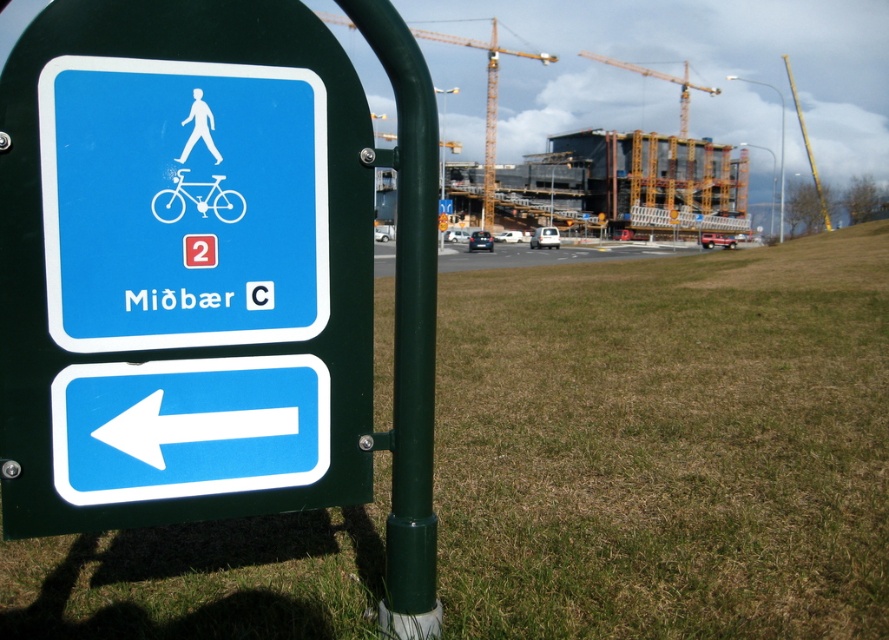
Is green grass at lower center shorter than blue plastic arrow at lower left?

No, green grass at lower center is not shorter than blue plastic arrow at lower left.

Is green grass at lower center above blue plastic arrow at lower left?

Indeed, green grass at lower center is positioned over blue plastic arrow at lower left.

From the picture: Who is more distant from viewer, (770, 416) or (154, 380)?

Positioned behind is point (770, 416).

What are the coordinates of `green grass at lower center` in the screenshot? It's located at (667, 444).

Can you confirm if green grass at lower center is taller than matte plastic sign at left?

Indeed, green grass at lower center has a greater height compared to matte plastic sign at left.

Where is `green grass at lower center`? green grass at lower center is located at coordinates (667, 444).

Identify the location of green grass at lower center. (667, 444).

Is yellow metallic crane at upper center wider than white glossy bicycle at center?

Yes.

Is yellow metallic crane at upper center smaller than white glossy bicycle at center?

No, yellow metallic crane at upper center is not smaller than white glossy bicycle at center.

In order to click on yellow metallic crane at upper center in this screenshot , I will do `click(486, 99)`.